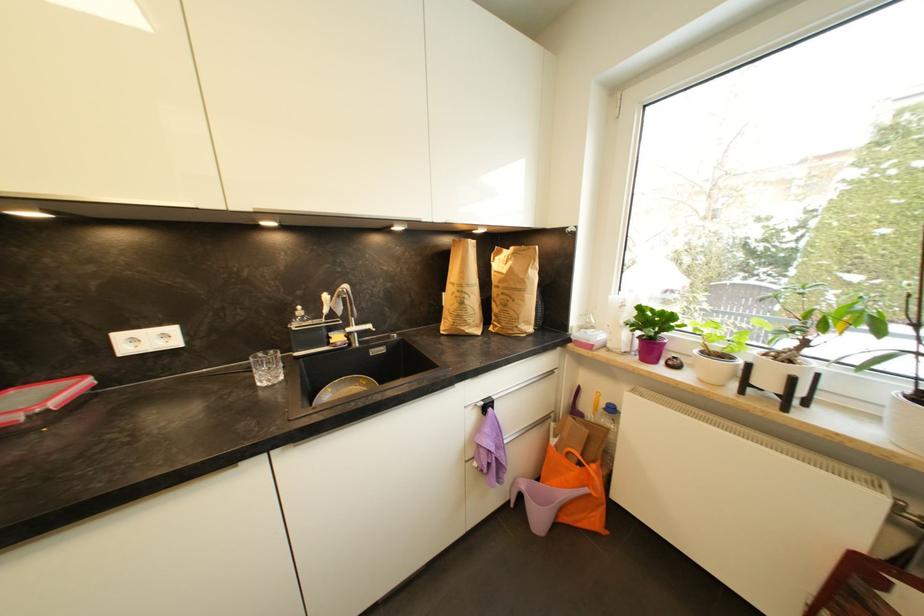
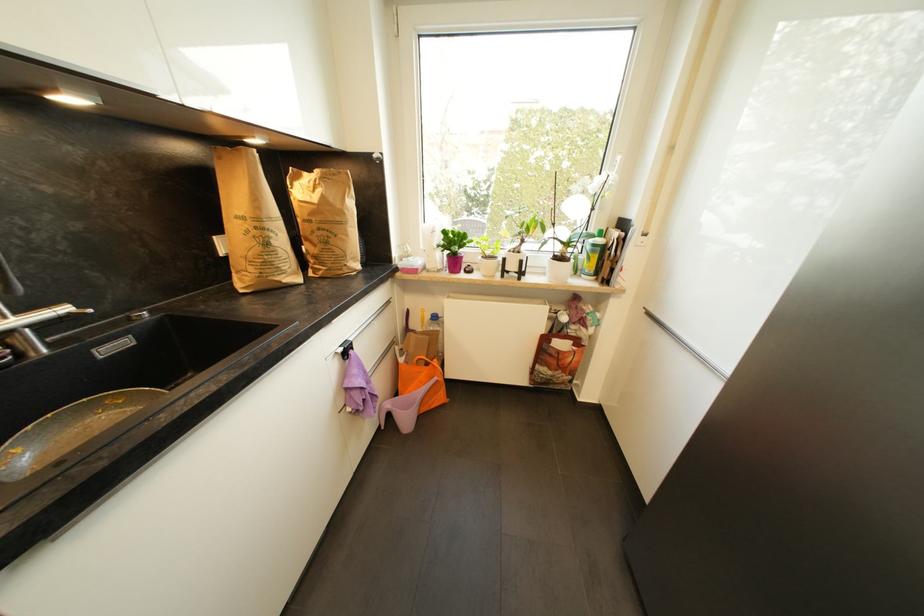
Where in the second image is the point corresponding to (700,353) from the first image?

(484, 259)